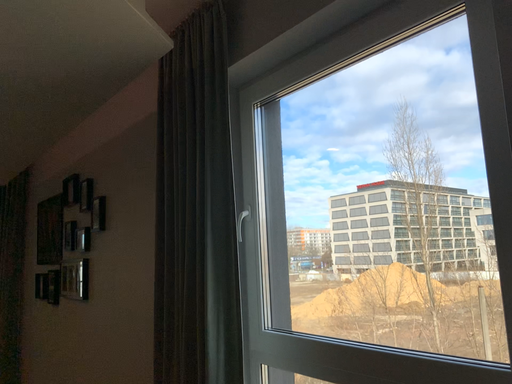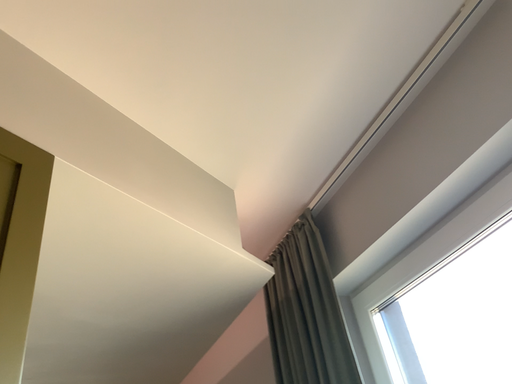
Question: Which way did the camera rotate in the video?

Choices:
 (A) rotated right
 (B) rotated left

Answer: (B)